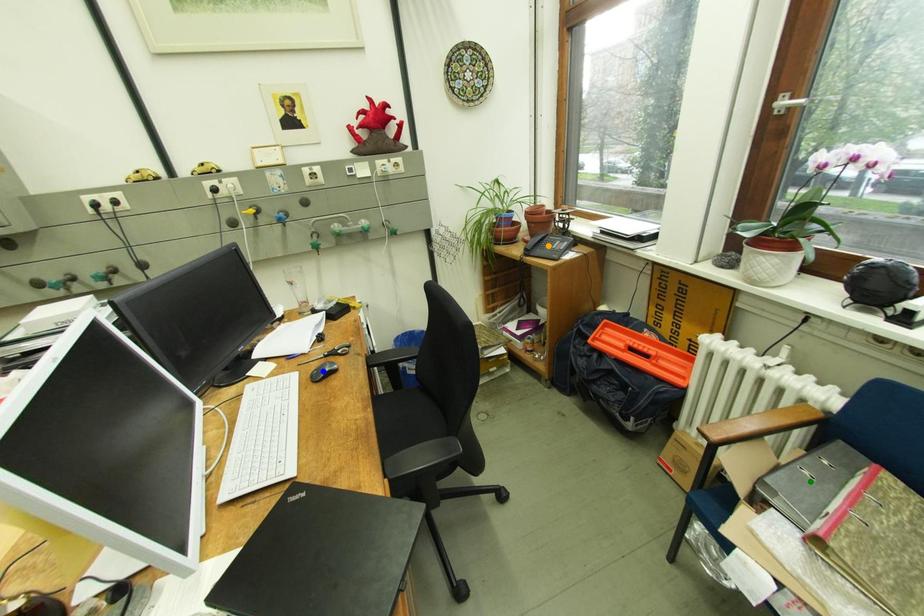
Order these from nearest to farthest:
orange point | blue point | green point

1. green point
2. blue point
3. orange point